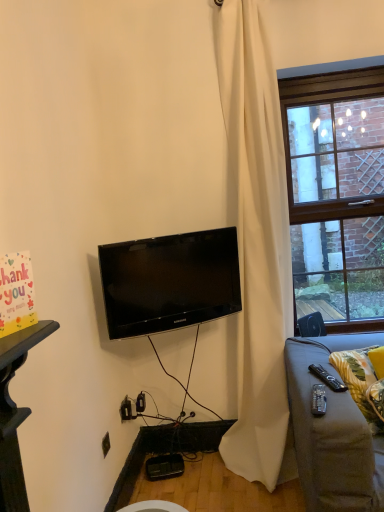
Question: Is brick wall at right taller or shorter than black glossy tv at center?

Choices:
 (A) short
 (B) tall

Answer: (B)

Question: From the image's perspective, is brick wall at right positioned above or below black glossy tv at center?

Choices:
 (A) above
 (B) below

Answer: (A)

Question: Estimate the real-world distances between objects in this image. Which object is closer to the white matte curtain at center?

Choices:
 (A) black glossy tv at center
 (B) brick wall at right
 (C) black plastic remote control at lower right, which ranks as the first remote control in back-to-front order
 (D) yellow fabric pillow at lower right
 (E) black plastic remote control at lower right, the first remote control in the front-to-back sequence

Answer: (A)

Question: Which object is the closest to the black plastic remote control at lower right, placed as the second remote control when sorted from front to back?

Choices:
 (A) black glossy tv at center
 (B) black plastic remote control at lower right, marked as the 2th remote control in a back-to-front arrangement
 (C) yellow fabric pillow at lower right
 (D) brick wall at right
 (E) white matte curtain at center

Answer: (B)